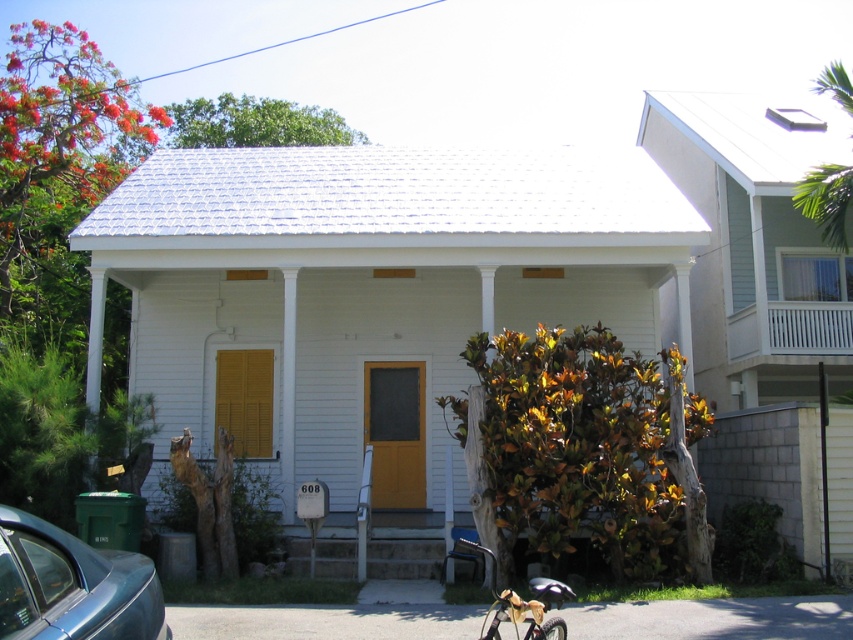
Question: Can you confirm if white painted wood porch at upper right is positioned above metallic gold bicycle at lower center?

Choices:
 (A) yes
 (B) no

Answer: (A)

Question: Can you confirm if metallic silver bicycle at lower center is smaller than metallic gold bicycle at lower center?

Choices:
 (A) yes
 (B) no

Answer: (B)

Question: Which point appears farthest from the camera in this image?

Choices:
 (A) [555, 582]
 (B) [561, 593]
 (C) [16, 632]

Answer: (A)

Question: Does metallic blue car at lower left appear on the left side of metallic gold bicycle at lower center?

Choices:
 (A) no
 (B) yes

Answer: (B)

Question: Which point is farther to the camera?

Choices:
 (A) (561, 636)
 (B) (798, 307)
 (C) (22, 582)
 (D) (490, 634)

Answer: (B)

Question: Which object appears closest to the camera in this image?

Choices:
 (A) metallic gold bicycle at lower center
 (B) metallic silver bicycle at lower center
 (C) metallic blue car at lower left

Answer: (C)